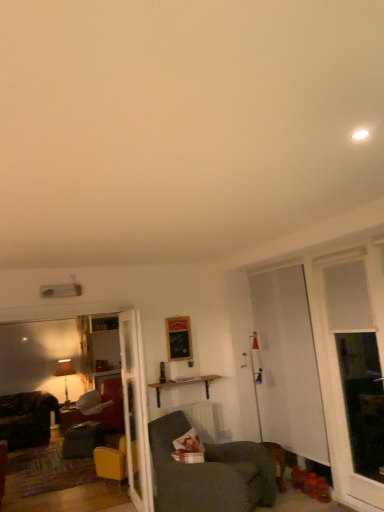
What are the coordinates of `wooden picture frame at center` in the screenshot? It's located at (178, 338).

Describe the element at coordinates (65, 374) in the screenshot. The width and height of the screenshot is (384, 512). I see `matte black lamp at left` at that location.

What do you see at coordinates (26, 419) in the screenshot?
I see `dark gray fabric chair at left, which appears as the second chair when viewed from the top` at bounding box center [26, 419].

Locate an element on the screen. This screenshot has height=512, width=384. white textured window at right is located at coordinates (338, 355).

Which point is more forward, (315, 329) or (67, 411)?

The point (315, 329) is closer.

Who is bigger, white textured window at right or brushed wood desk at lower left?

white textured window at right.

How distant is white textured window at right from brushed wood desk at lower left?

white textured window at right and brushed wood desk at lower left are 13.20 feet apart.

Is white textured window at right not close to brushed wood desk at lower left?

white textured window at right is far away from brushed wood desk at lower left.

Is brushed wood desk at lower left facing away from dark gray fabric chair at lower center, the 2th chair ordered from the bottom?

That's not correct — brushed wood desk at lower left is not looking away from dark gray fabric chair at lower center, the 2th chair ordered from the bottom.

Is brushed wood desk at lower left not inside dark gray fabric chair at lower center, the 2th chair ordered from the bottom?

brushed wood desk at lower left is positioned outside dark gray fabric chair at lower center, the 2th chair ordered from the bottom.

In terms of size, does brushed wood desk at lower left appear bigger or smaller than dark gray fabric chair at lower center, the first chair viewed from the right?

Clearly, brushed wood desk at lower left is smaller in size than dark gray fabric chair at lower center, the first chair viewed from the right.

From a real-world perspective, which object stands above the other?

dark gray fabric chair at lower center, which is the 2th chair in left-to-right order, is physically above.

In the scene shown: Considering the relative sizes of matte black lamp at left and wooden picture frame at center in the image provided, is matte black lamp at left shorter than wooden picture frame at center?

No.

Which is behind, point (60, 361) or point (189, 338)?

The point (60, 361) is farther from the camera.

Based on the photo, looking at their sizes, would you say matte black lamp at left is wider or thinner than wooden picture frame at center?

matte black lamp at left is wider than wooden picture frame at center.

From the image's perspective, which object appears higher, matte black lamp at left or wooden picture frame at center?

wooden picture frame at center appears higher in the image.

From the image's perspective, does velvet dark grey swivel chair at lower left appear lower than white textured window at right?

Indeed, from the image's perspective, velvet dark grey swivel chair at lower left is shown beneath white textured window at right.

Considering the sizes of objects velvet dark grey swivel chair at lower left and white textured window at right in the image provided, who is taller, velvet dark grey swivel chair at lower left or white textured window at right?

With more height is white textured window at right.

You are a GUI agent. You are given a task and a screenshot of the screen. Output one action in this format:
    pyautogui.click(x=<x>, y=<y>)
    Task: Click on the swivel chair below the white textured window at right (from a real-world perspective)
    Image resolution: width=384 pixels, height=512 pixels.
    Given the screenshot: What is the action you would take?
    pyautogui.click(x=82, y=440)

Is velvet dark grey swivel chair at lower left positioned beyond the bounds of white textured window at right?

Indeed, velvet dark grey swivel chair at lower left is completely outside white textured window at right.

From a real-world perspective, which is physically above, white translucent screen door at right or velvet dark grey swivel chair at lower left?

white translucent screen door at right.

Is white translucent screen door at right facing towards velvet dark grey swivel chair at lower left?

No, white translucent screen door at right is not aimed at velvet dark grey swivel chair at lower left.

Which of these two, white translucent screen door at right or velvet dark grey swivel chair at lower left, is bigger?

With larger size is white translucent screen door at right.

Is white translucent screen door at right further to camera compared to velvet dark grey swivel chair at lower left?

No, white translucent screen door at right is closer to the viewer.

Can you confirm if matte gray fabric couch at center-left is shorter than velvet dark grey swivel chair at lower left?

In fact, matte gray fabric couch at center-left may be taller than velvet dark grey swivel chair at lower left.

Does matte gray fabric couch at center-left have a smaller size compared to velvet dark grey swivel chair at lower left?

No.

Can velvet dark grey swivel chair at lower left be found inside matte gray fabric couch at center-left?

No, velvet dark grey swivel chair at lower left is not inside matte gray fabric couch at center-left.

Does point (106, 430) appear closer or farther from the camera than point (74, 441)?

Point (106, 430) is closer to the camera than point (74, 441).

Between dark gray fabric chair at left, which appears as the second chair when viewed from the top, and white textured window at right, which one appears on the left side from the viewer's perspective?

From the viewer's perspective, dark gray fabric chair at left, which appears as the second chair when viewed from the top, appears more on the left side.

How many degrees apart are the facing directions of dark gray fabric chair at left, which appears as the 1th chair when ordered from the bottom, and white textured window at right?

89.1 degrees.

Between point (38, 395) and point (369, 294), which one is positioned in front?

Point (369, 294)

The width and height of the screenshot is (384, 512). What are the coordinates of `window lying above the brushed wood desk at lower left (from the image's perspective)` in the screenshot? It's located at (338, 355).

Locate an element on the screen. the 2nd chair in front of the brushed wood desk at lower left is located at coordinates (209, 473).

When comparing their distances from brushed wood desk at lower left, does dark gray fabric chair at lower center, the first chair viewed from the right, or wooden picture frame at center seem closer?

wooden picture frame at center lies closer to brushed wood desk at lower left than the other object.

Which object lies nearer to the anchor point velvet dark grey swivel chair at lower left, brushed wood desk at lower left or white textured window at right?

brushed wood desk at lower left is positioned closer to the anchor velvet dark grey swivel chair at lower left.

From the image, which object appears to be nearer to white translucent screen door at right, white glossy door at center or dark gray fabric chair at lower center, the 1th chair in the top-to-bottom sequence?

dark gray fabric chair at lower center, the 1th chair in the top-to-bottom sequence.

Based on the photo, estimate the real-world distances between objects in this image. Which object is further from dark gray fabric chair at left, which appears as the second chair when viewed from the top, white textured window at right or white glossy door at center?

white textured window at right is positioned further to the anchor dark gray fabric chair at left, which appears as the second chair when viewed from the top.

When comparing their distances from white translucent screen door at right, does matte gray fabric couch at center-left or dark gray fabric chair at lower center, the first chair viewed from the right, seem closer?

Based on the image, dark gray fabric chair at lower center, the first chair viewed from the right, appears to be nearer to white translucent screen door at right.

Based on their spatial positions, is wooden shelf at center or white translucent screen door at right closer to velvet dark grey swivel chair at lower left?

wooden shelf at center is positioned closer to the anchor velvet dark grey swivel chair at lower left.

Looking at the image, which one is located further to wooden shelf at center, dark gray fabric chair at left, placed as the 2th chair when sorted from right to left, or white glossy door at center?

The object further to wooden shelf at center is dark gray fabric chair at left, placed as the 2th chair when sorted from right to left.

Looking at the image, which one is located further to white textured window at right, white glossy door at center or matte black lamp at left?

matte black lamp at left lies further to white textured window at right than the other object.

Locate an element on the screen. Image resolution: width=384 pixels, height=512 pixels. table between white glossy door at center and dark gray fabric chair at left, arranged as the 1th chair when viewed from the back, along the z-axis is located at coordinates (184, 384).

Locate an element on the screen. The height and width of the screenshot is (512, 384). chair situated between dark gray fabric chair at left, marked as the 2th chair in a front-to-back arrangement, and white translucent screen door at right from left to right is located at coordinates (209, 473).

At what (x,y) coordinates should I click in order to perform the action: click on table between dark gray fabric chair at left, marked as the 2th chair in a front-to-back arrangement, and white translucent screen door at right. Please return your answer as a coordinate pair (x, y). The width and height of the screenshot is (384, 512). Looking at the image, I should click on (184, 384).

This screenshot has height=512, width=384. Identify the location of door situated between dark gray fabric chair at left, placed as the 2th chair when sorted from right to left, and white textured window at right from left to right. (134, 409).